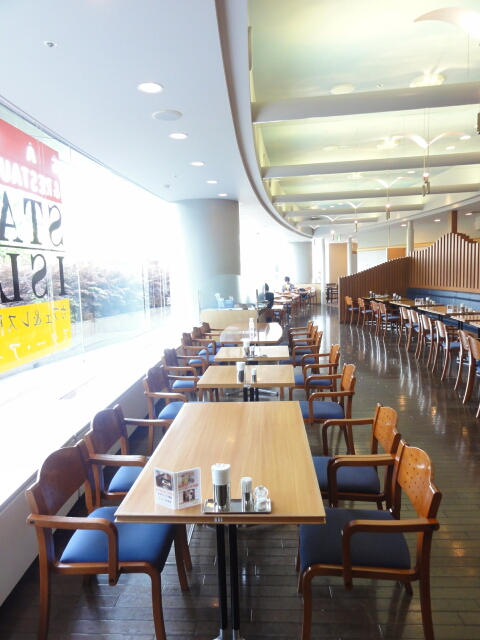
Identify the location of seat cushions on the two nearest tables only. (356, 472), (122, 470), (130, 534), (349, 518), (309, 404), (300, 377), (186, 380), (174, 406).